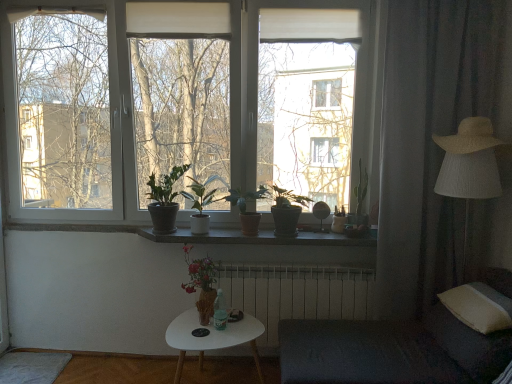
Question: In the image, is green matte plant at center, marked as the 4th houseplant in a right-to-left arrangement, positioned in front of or behind green matte plant at center, acting as the 1th houseplant starting from the left?

Choices:
 (A) behind
 (B) front

Answer: (B)

Question: From a real-world perspective, relative to green matte plant at center, acting as the 1th houseplant starting from the left, is green matte plant at center, the second houseplant from the left, vertically above or below?

Choices:
 (A) below
 (B) above

Answer: (A)

Question: Estimate the real-world distances between objects in this image. Which object is closer to the green matte plant at center, marked as the 1th houseplant in a right-to-left arrangement?

Choices:
 (A) green matte plant at center, the 2th houseplant in the right-to-left sequence
 (B) matte brown vase at center, the third houseplant viewed from the left
 (C) brown matte window sill at center
 (D) green matte cactus at upper right
 (E) strawmaterial/texturehat at right

Answer: (A)

Question: Which of these objects is positioned farthest from the green matte plant at center, marked as the 4th houseplant in a left-to-right arrangement?

Choices:
 (A) brown matte window sill at center
 (B) green matte cactus at upper right
 (C) white soft pillow at lower right
 (D) gray fabric curtain at right
 (E) green matte plant at center, marked as the 1th houseplant in a right-to-left arrangement

Answer: (C)